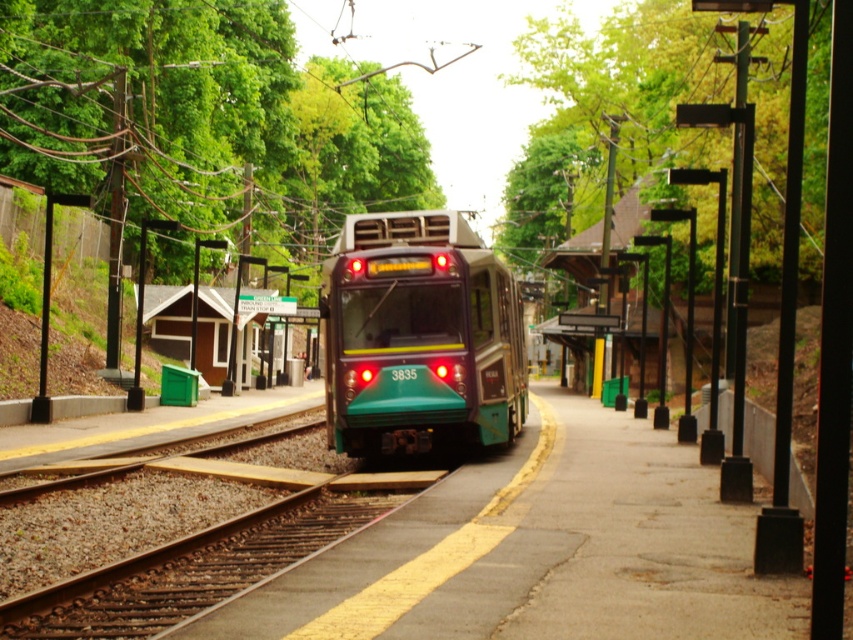
Does green matte train at center appear on the left side of green metallic track at center?

In fact, green matte train at center is to the right of green metallic track at center.

Which of these two, green matte train at center or green metallic track at center, stands taller?

green matte train at center

The width and height of the screenshot is (853, 640). What are the coordinates of `green matte train at center` in the screenshot? It's located at (419, 337).

The width and height of the screenshot is (853, 640). What are the coordinates of `green matte train at center` in the screenshot? It's located at (419, 337).